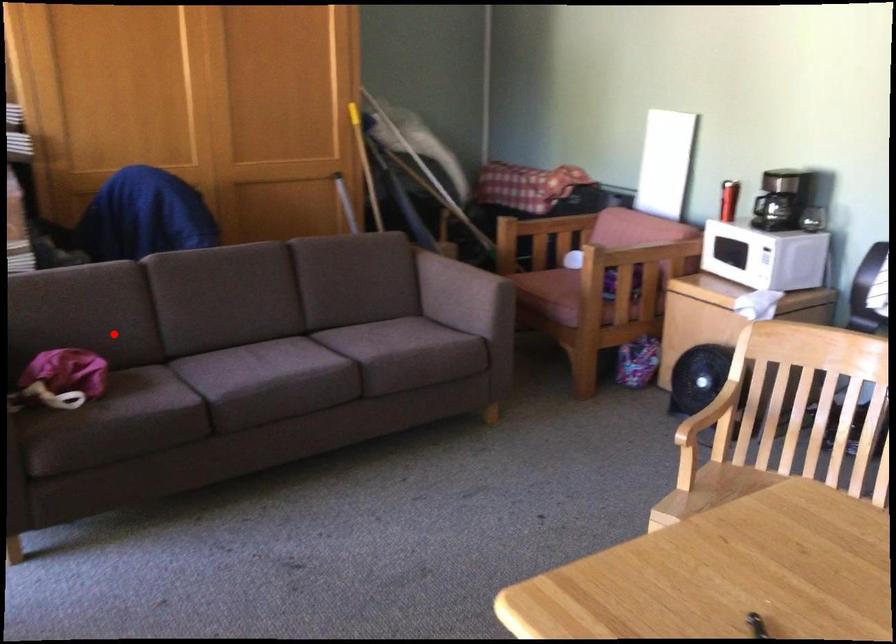
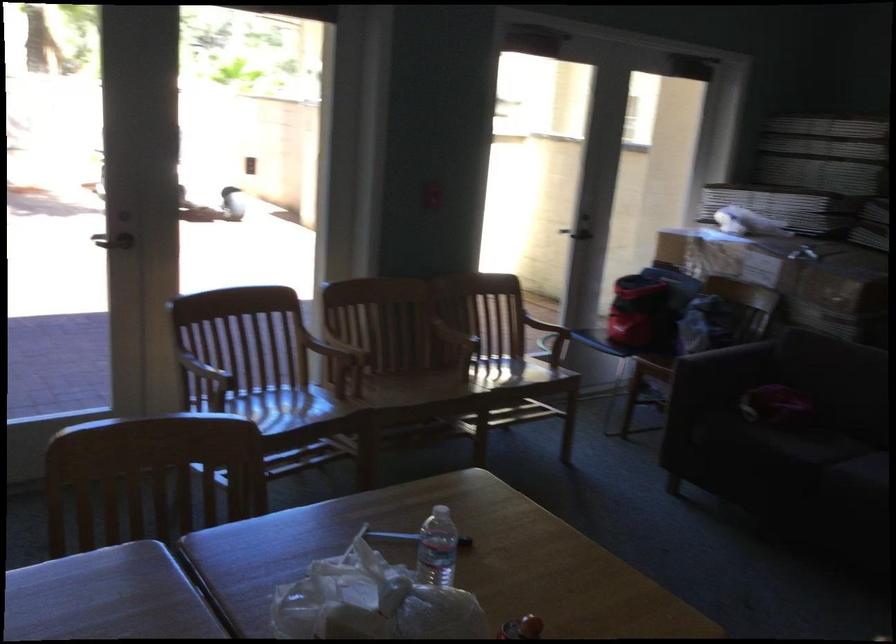
Question: I am providing you with two images of the same scene from different viewpoints. In image1, a red point is highlighted. Considering the same 3D point in image2, which of the following is correct?

Choices:
 (A) It is closer
 (B) It is farther

Answer: (B)